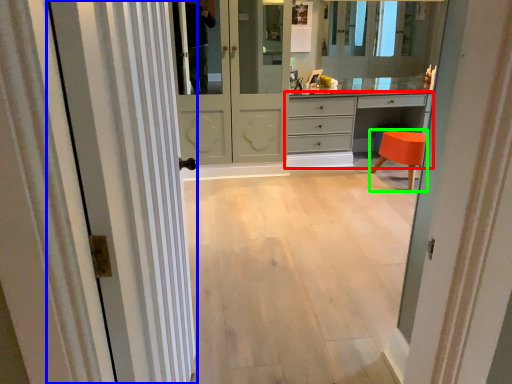
Question: Estimate the real-world distances between objects in this image. Which object is farther from chest of drawers (highlighted by a red box), door (highlighted by a blue box) or stool (highlighted by a green box)?

Choices:
 (A) door
 (B) stool

Answer: (A)